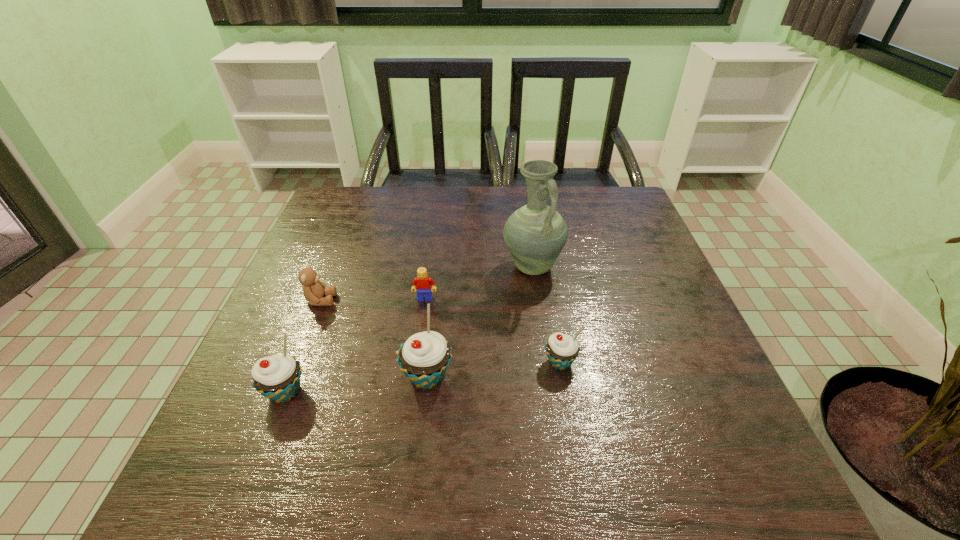
Identify the location of free space at the left edge of the desktop. (323, 243).

Identify the location of vacant space at the right edge of the desktop. The height and width of the screenshot is (540, 960). [709, 396].

At what (x,y) coordinates should I click in order to perform the action: click on vacant region at the far left corner of the desktop. Please return your answer as a coordinate pair (x, y). This screenshot has height=540, width=960. Looking at the image, I should click on (337, 231).

Where is `vacant area at the near left corner`? The image size is (960, 540). vacant area at the near left corner is located at coordinates (285, 424).

Where is `vacant space in between the farthest object and the third tallest object`? This screenshot has width=960, height=540. vacant space in between the farthest object and the third tallest object is located at coordinates (409, 329).

What are the coordinates of `vacant area that lies between the leftmost cupcake and the teddy bear` in the screenshot? It's located at (302, 346).

Find the location of a particular element. This screenshot has height=540, width=960. vacant region between the tallest cupcake and the teddy bear is located at coordinates (373, 339).

Where is `vacant area that lies between the farthest object and the rightmost cupcake`? This screenshot has width=960, height=540. vacant area that lies between the farthest object and the rightmost cupcake is located at coordinates (546, 314).

You are a GUI agent. You are given a task and a screenshot of the screen. Output one action in this format:
    pyautogui.click(x=<x>, y=<y>)
    Task: Click on the free space between the tallest cupcake and the second tallest cupcake
    This screenshot has height=540, width=960.
    Given the screenshot: What is the action you would take?
    pyautogui.click(x=356, y=384)

You are a GUI agent. You are given a task and a screenshot of the screen. Output one action in this format:
    pyautogui.click(x=<x>, y=<y>)
    Task: Click on the vacant space that is in between the teddy bear and the tallest cupcake
    The width and height of the screenshot is (960, 540).
    Given the screenshot: What is the action you would take?
    pyautogui.click(x=373, y=339)